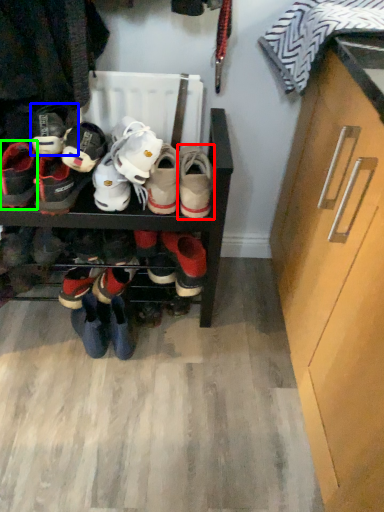
Question: Considering the real-world distances, which object is farthest from footwear (highlighted by a red box)? footwear (highlighted by a blue box) or footwear (highlighted by a green box)?

Choices:
 (A) footwear
 (B) footwear

Answer: (B)